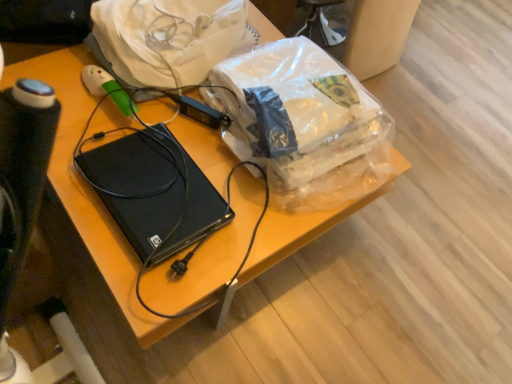
This screenshot has height=384, width=512. Identify the location of vacant space situated above black plastic computer at center (from a real-world perspective). (156, 188).